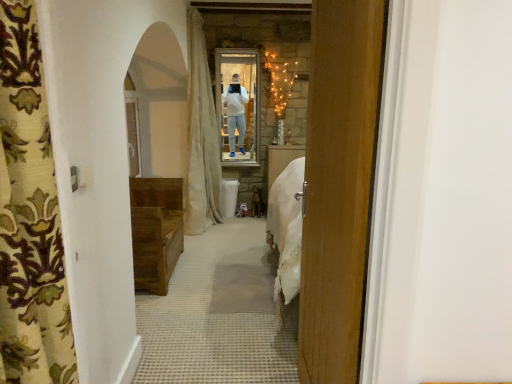
Question: Is matte glass mirror at center wider or thinner than wooden chest at left?

Choices:
 (A) wide
 (B) thin

Answer: (B)

Question: Is point (230, 77) positioned closer to the camera than point (159, 283)?

Choices:
 (A) closer
 (B) farther

Answer: (B)

Question: Which object is the closest to the wooden door at center?

Choices:
 (A) matte glass mirror at center
 (B) white fabric curtain at center, the 2th curtain viewed from the front
 (C) wooden chest at left
 (D) patterned fabric curtain at left, the first curtain viewed from the front

Answer: (D)

Question: Based on their relative distances, which object is farther from the matte glass mirror at center?

Choices:
 (A) patterned fabric curtain at left, the first curtain viewed from the front
 (B) wooden chest at left
 (C) white fabric curtain at center, placed as the first curtain when sorted from back to front
 (D) wooden door at center

Answer: (A)